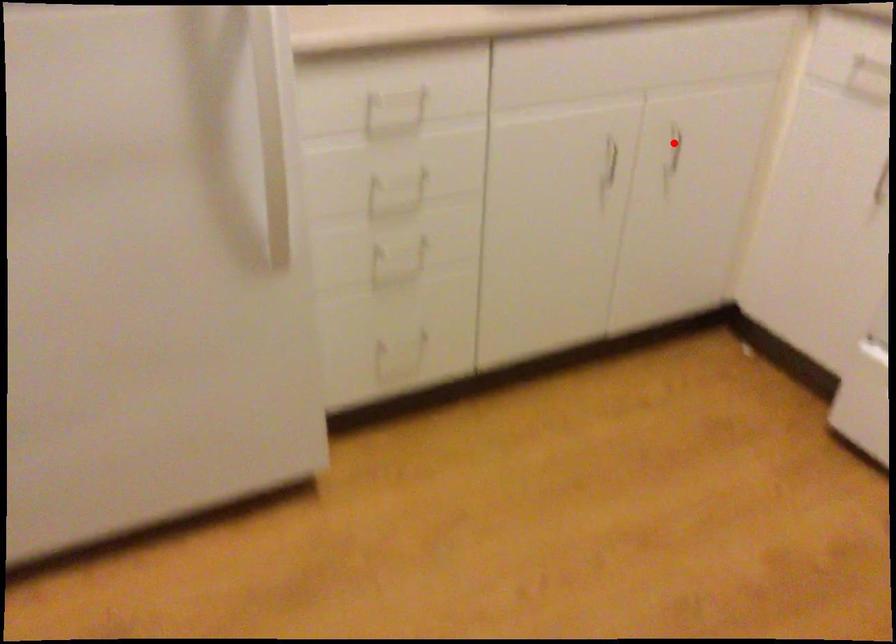
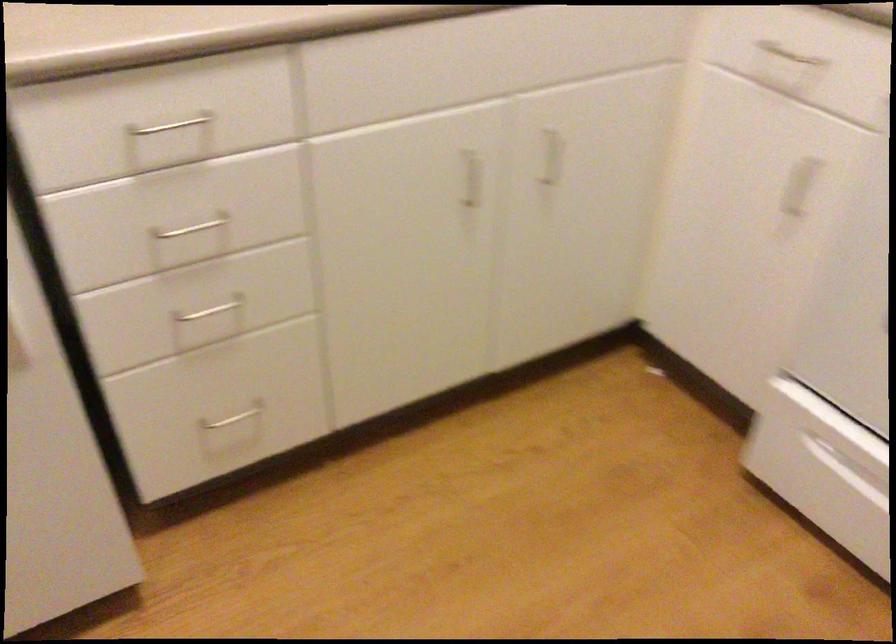
Question: I am providing you with two images of the same scene from different viewpoints. Image1 has a red point marked. In image2, the corresponding 3D location appears at what relative position? Reply with the corresponding letter.

Choices:
 (A) Closer
 (B) Farther

Answer: (A)